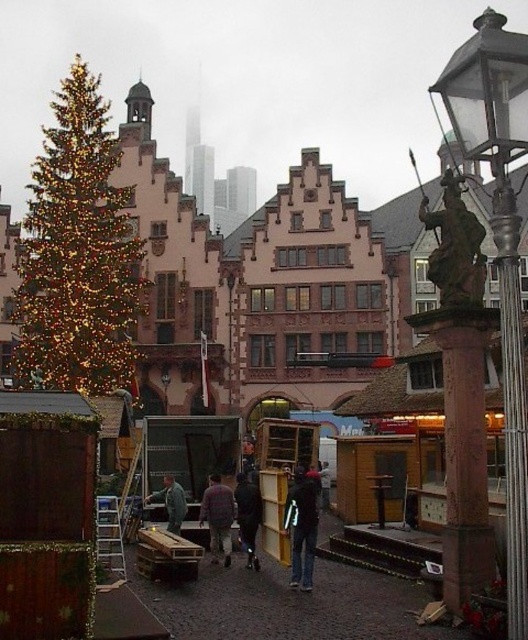
Who is higher up, bronze/brass streetlamp at right or dark gray jacket at center?

Positioned higher is bronze/brass streetlamp at right.

Between bronze/brass streetlamp at right and dark gray jacket at center, which one appears on the right side from the viewer's perspective?

bronze/brass streetlamp at right

This screenshot has height=640, width=528. Find the location of `bronze/brass streetlamp at right`. bronze/brass streetlamp at right is located at coordinates (499, 243).

Does dark blue jeans at center appear on the right side of dark gray jacket at center?

Correct, you'll find dark blue jeans at center to the right of dark gray jacket at center.

Which is below, dark blue jeans at center or dark gray jacket at center?

Positioned lower is dark gray jacket at center.

Between point (315, 500) and point (172, 477), which one is positioned behind?

The point (172, 477) is more distant.

Locate an element on the screen. The width and height of the screenshot is (528, 640). dark blue jeans at center is located at coordinates (301, 525).

Does shiny gold christmas tree at left appear over dark gray jacket at center?

Yes.

Is shiny gold christmas tree at left in front of dark gray jacket at center?

No, it is behind dark gray jacket at center.

Is point (111, 380) positioned behind point (181, 508)?

Yes, it is behind point (181, 508).

Where is `shiny gold christmas tree at left`? The width and height of the screenshot is (528, 640). shiny gold christmas tree at left is located at coordinates (78, 253).